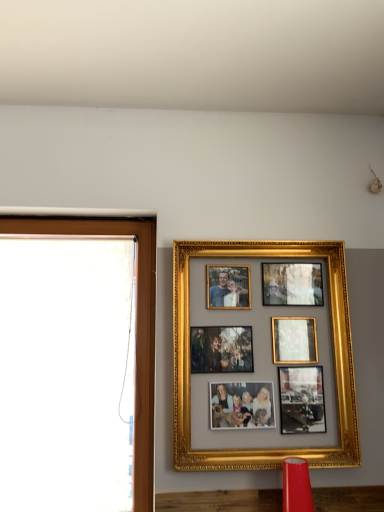
Question: From their relative heights in the image, would you say matte red lampshade at lower center is taller or shorter than gold/gilded photo frame at upper center?

Choices:
 (A) short
 (B) tall

Answer: (A)

Question: Considering their positions, is matte red lampshade at lower center located in front of or behind gold/gilded photo frame at upper center?

Choices:
 (A) behind
 (B) front

Answer: (B)

Question: Which object is the closest to the matte red lampshade at lower center?

Choices:
 (A) brown wooden window frame at left
 (B) gold/gilded photo frame at upper center

Answer: (B)

Question: Which of these objects is positioned farthest from the gold/gilded photo frame at upper center?

Choices:
 (A) brown wooden window frame at left
 (B) matte red lampshade at lower center

Answer: (A)